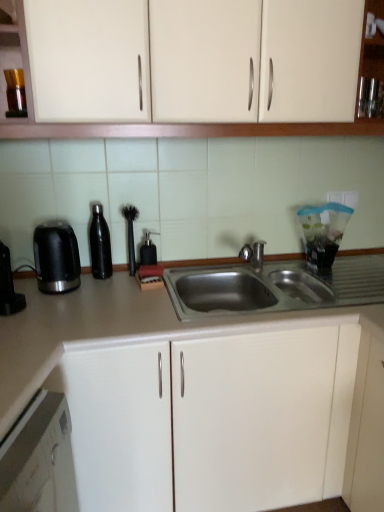
Where is `vacant area that is in front of black plastic kettle at left`? Image resolution: width=384 pixels, height=512 pixels. vacant area that is in front of black plastic kettle at left is located at coordinates (53, 309).